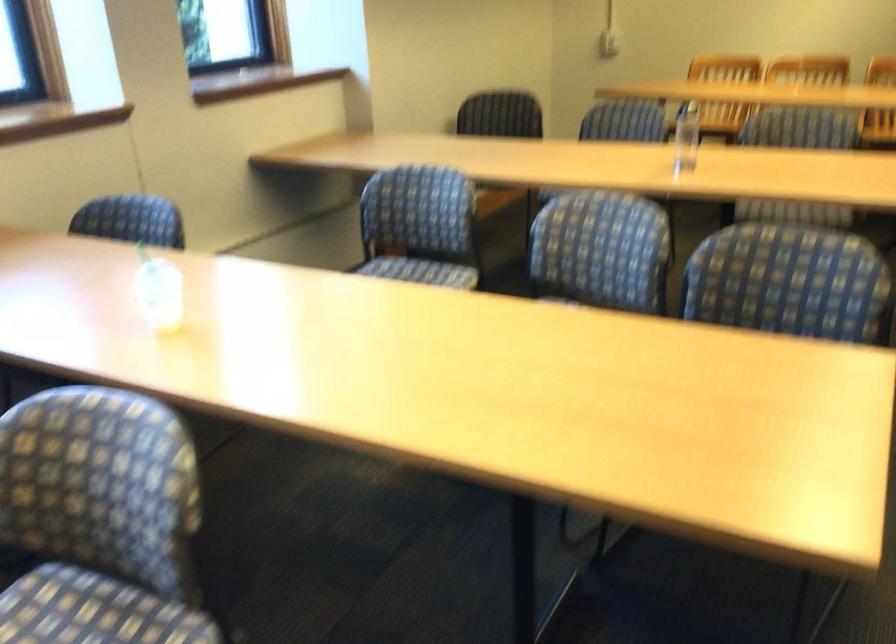
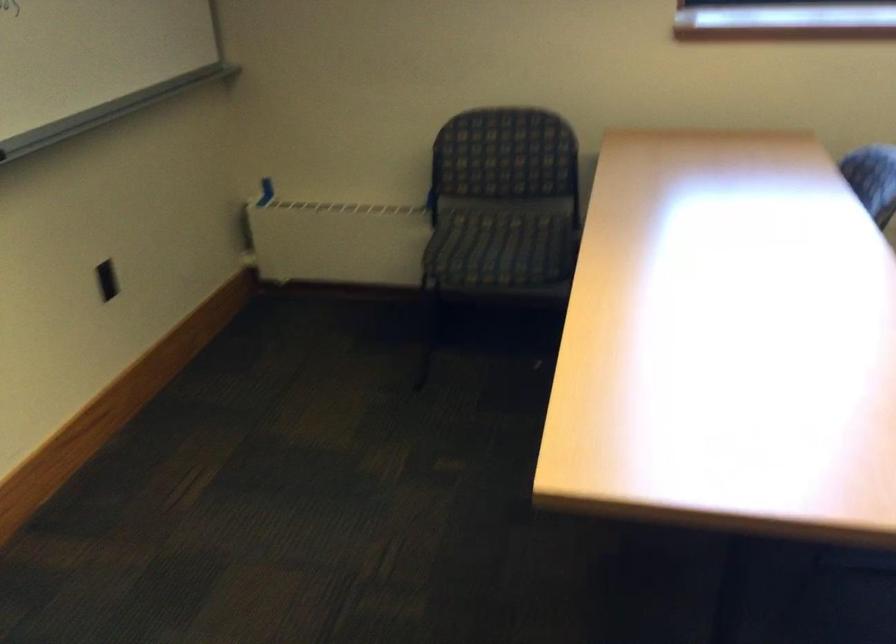
First-person continuous shooting, in which direction is the camera rotating?

The camera rotated toward left-down.